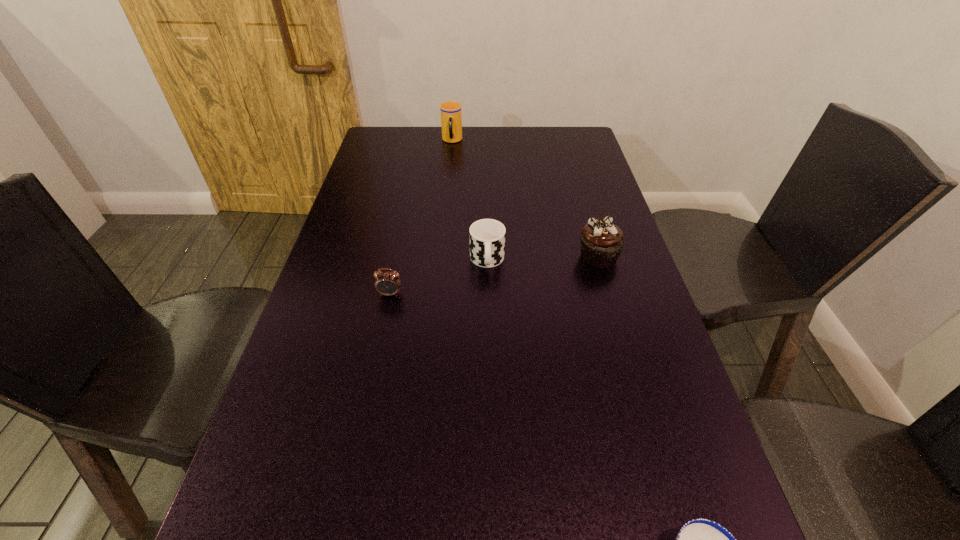
Find the location of a particular element. vacant space located on the face of the second nearest object is located at coordinates (354, 470).

The height and width of the screenshot is (540, 960). I want to click on object located in the far edge section of the desktop, so click(451, 111).

This screenshot has width=960, height=540. In order to click on object located at the left edge in this screenshot , I will do `click(386, 283)`.

You are a GUI agent. You are given a task and a screenshot of the screen. Output one action in this format:
    pyautogui.click(x=<x>, y=<y>)
    Task: Click on the object that is at the right edge
    
    Given the screenshot: What is the action you would take?
    pyautogui.click(x=602, y=242)

I want to click on free region at the far edge, so tap(425, 144).

In the image, there is a desktop. Where is `vacant region at the left edge`? The width and height of the screenshot is (960, 540). vacant region at the left edge is located at coordinates (325, 260).

I want to click on vacant space at the right edge of the desktop, so click(x=606, y=319).

Image resolution: width=960 pixels, height=540 pixels. I want to click on vacant region at the far right corner of the desktop, so click(591, 152).

The height and width of the screenshot is (540, 960). Identify the location of vacant region between the leftmost object and the tallest cup. (420, 217).

The height and width of the screenshot is (540, 960). What are the coordinates of `empty location between the cupcake and the second cup from right to left` in the screenshot? It's located at (542, 259).